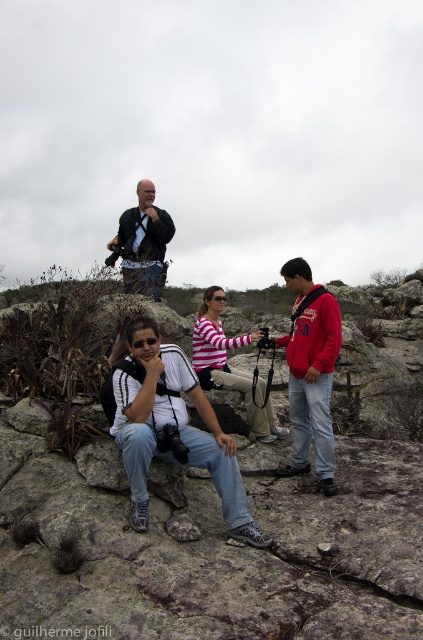
You are a hiker trying to take a photo of both the red fleece jacket at center and the striped cotton shirt at center. Which one should you focus on first to ensure both are in the frame?

You should focus on the red fleece jacket at center first since it is in front of the striped cotton shirt at center, ensuring both remain in the frame when adjusting the camera.

Based on the scene description, where is the striped cotton shirt at center located in terms of spatial coordinates?

The striped cotton shirt at center is located at point 0.569 in the x coordinate and 0.537 in the y coordinate.

You are a hiker planning to take a photo of the white matte shirt at center and the red fleece jacket at center. Which one should you focus on first to ensure both are in the frame?

The white matte shirt at center is in front of the red fleece jacket at center, so you should focus on the white matte shirt at center first to ensure both are in the frame.